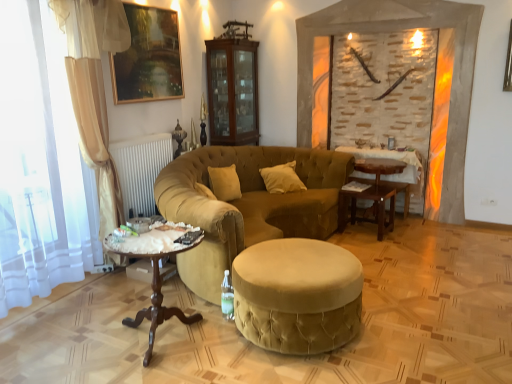
Question: In terms of height, does white sheer curtain at left look taller or shorter compared to velvet gold studio couch at center?

Choices:
 (A) short
 (B) tall

Answer: (B)

Question: From a real-world perspective, is white sheer curtain at left physically located above or below velvet gold studio couch at center?

Choices:
 (A) above
 (B) below

Answer: (A)

Question: Considering the real-world distances, which object is closest to the wooden polished table at lower left?

Choices:
 (A) white velvet pillow at center
 (B) velvet gold studio couch at center
 (C) white sheer curtain at left
 (D) stone textured fireplace at center
 (E) velvet beige stool at center

Answer: (E)

Question: Which object is the closest to the wooden table at center, the 1th table positioned from the front?

Choices:
 (A) wooden polished table at lower left
 (B) white velvet pillow at center
 (C) wooden table at center, which is counted as the second table, starting from the front
 (D) velvet gold studio couch at center
 (E) velvet beige stool at center

Answer: (C)